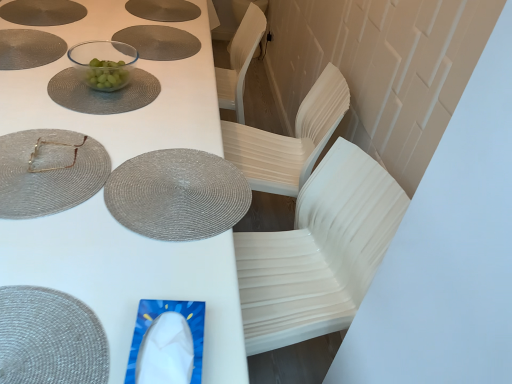
This screenshot has width=512, height=384. Identify the location of free space behind silver textured placemat at center, which is counted as the 2th tableware, starting from the bottom. (170, 119).